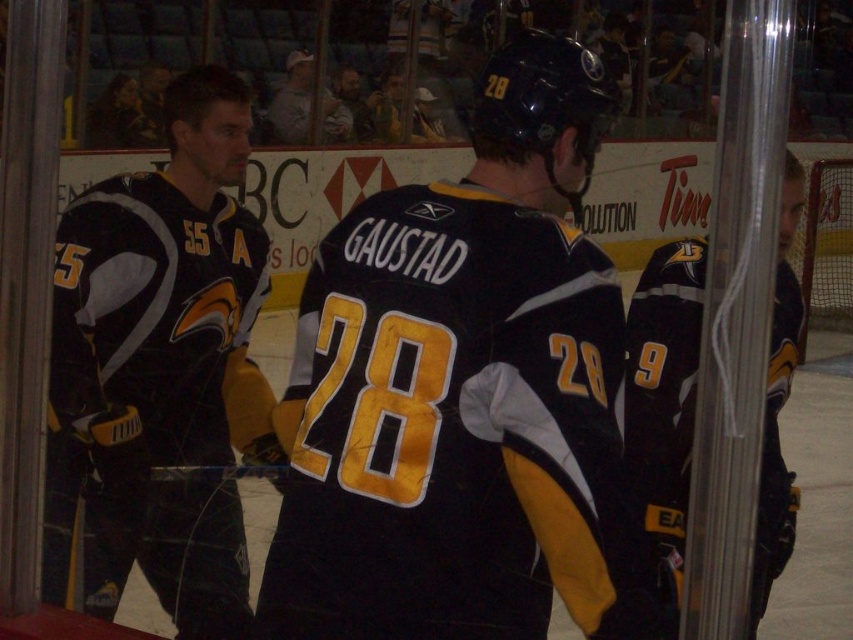
Question: Can you confirm if black matte jersey at right is positioned above gray cotton shirt at upper center?

Choices:
 (A) no
 (B) yes

Answer: (A)

Question: Does black jersey at center have a smaller size compared to black jersey at left?

Choices:
 (A) yes
 (B) no

Answer: (A)

Question: Which point is closer to the camera?

Choices:
 (A) gray cotton shirt at upper center
 (B) black jersey at center

Answer: (B)

Question: Does black jersey at center appear on the right side of black matte jersey at right?

Choices:
 (A) yes
 (B) no

Answer: (B)

Question: Which of the following is the closest to the observer?

Choices:
 (A) (291, 125)
 (B) (404, 456)
 (C) (692, 404)
 (D) (201, 326)

Answer: (B)

Question: Which point is farther to the camera?

Choices:
 (A) black matte jersey at right
 (B) black jersey at left

Answer: (B)